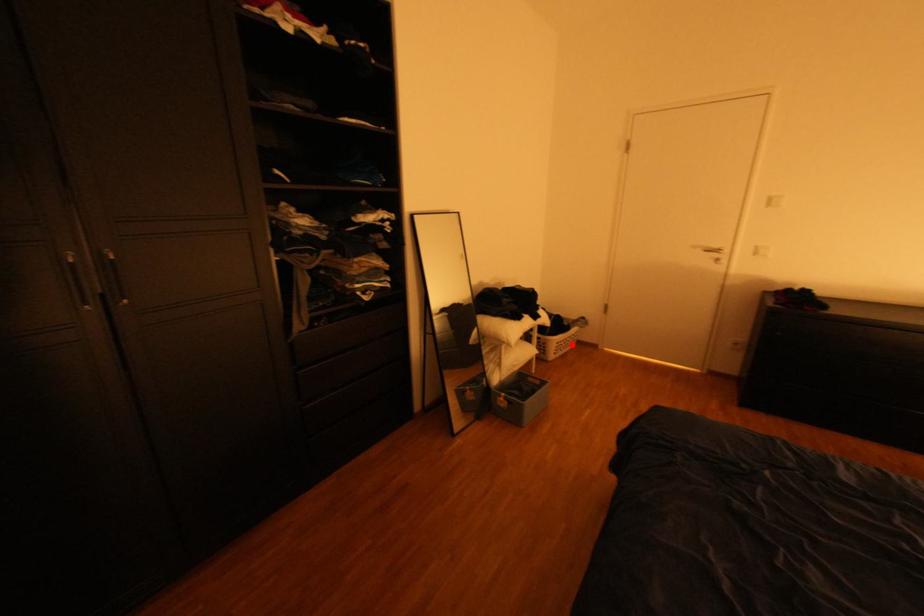
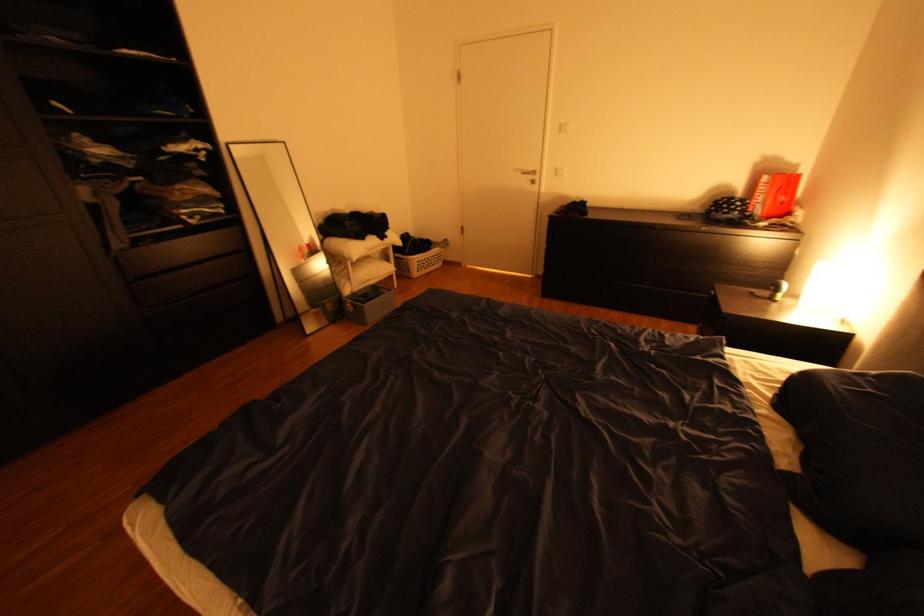
Question: I am providing you with two images of the same scene from different viewpoints. A red point is marked on the first image. Is the red point's position out of view in image 2?

Choices:
 (A) Yes
 (B) No

Answer: (B)